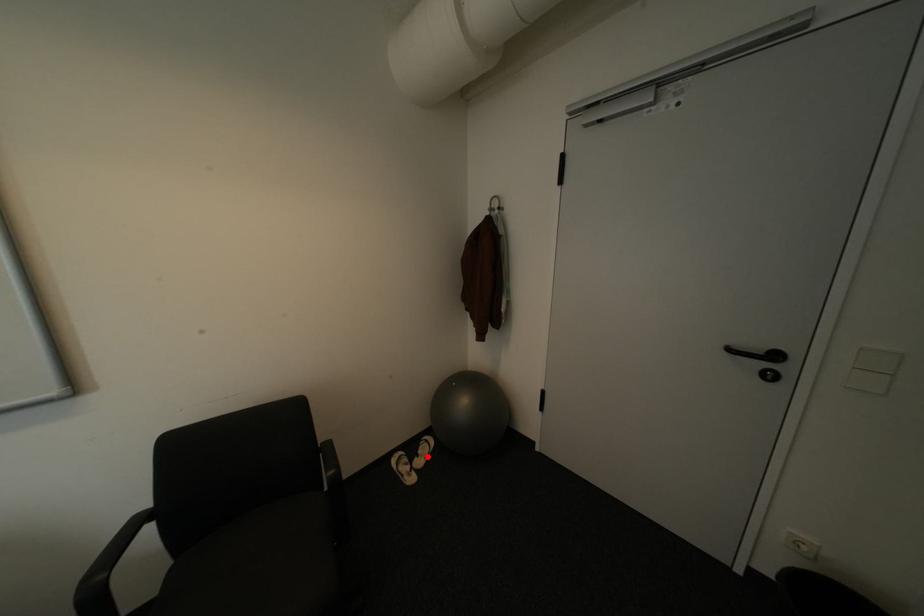
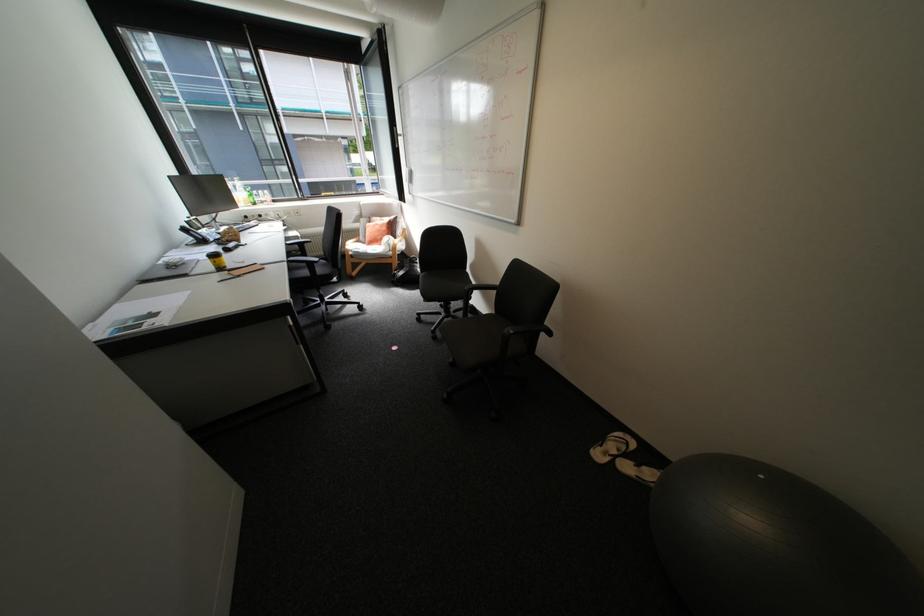
Question: A red point is marked in image1. In image2, is the corresponding 3D point closer to the camera or farther? Reply with the corresponding letter.

Choices:
 (A) The corresponding 3D point is closer.
 (B) The corresponding 3D point is farther.

Answer: (A)